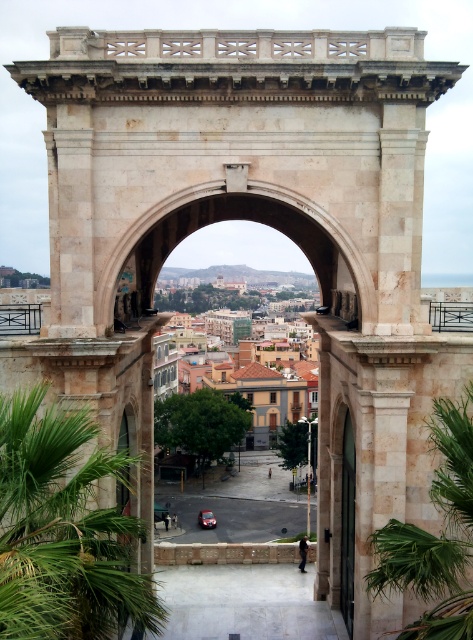
The image size is (473, 640). What do you see at coordinates (63, 531) in the screenshot?
I see `green leafy palm tree at left` at bounding box center [63, 531].

Who is taller, green leafy palm tree at left or shiny red car at center?

green leafy palm tree at left is taller.

Is point (61, 484) positioned before point (207, 513)?

Yes, point (61, 484) is closer to viewer.

Identify the location of green leafy palm tree at left. (63, 531).

Consider the image. Which of these two, green leafy palm at right or shiny red car at center, stands shorter?

shiny red car at center

Does green leafy palm at right have a lesser width compared to shiny red car at center?

No.

Identify the location of green leafy palm at right. This screenshot has width=473, height=640. (435, 536).

This screenshot has height=640, width=473. I want to click on green leafy palm at right, so click(x=435, y=536).

Does green leafy palm at right appear over white stone archway at center?

Actually, green leafy palm at right is below white stone archway at center.

Describe the element at coordinates (435, 536) in the screenshot. I see `green leafy palm at right` at that location.

Identify the location of green leafy palm at right. This screenshot has width=473, height=640. (435, 536).